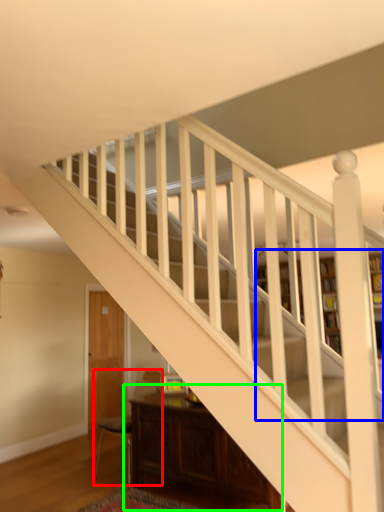
Question: Which object is positioned closest to armchair (highlighted by a red box)? Select from bookcase (highlighted by a blue box) and table (highlighted by a green box).

Choices:
 (A) bookcase
 (B) table

Answer: (B)